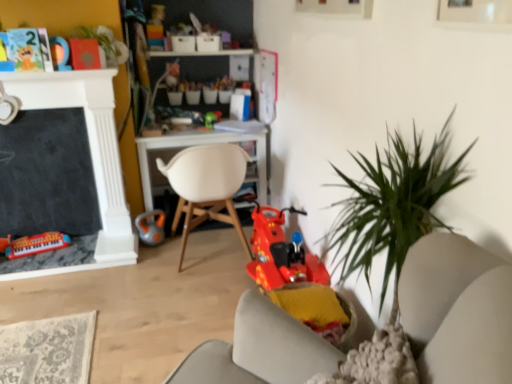
What are the coordinates of `free space in front of orange rubber kettlebell at center, the 3th toy viewed from the top` in the screenshot? It's located at (155, 255).